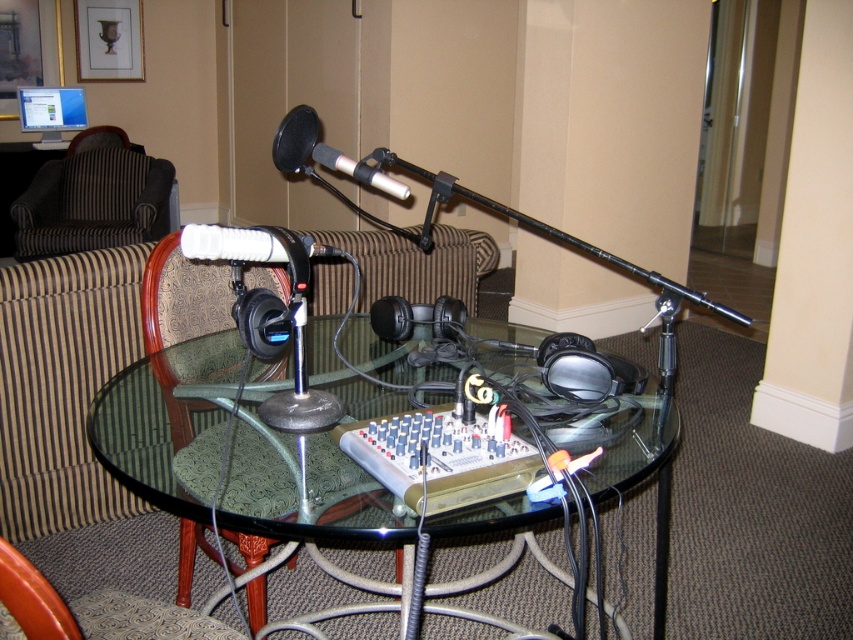
Which is below, striped fabric couch at center or matte black microphone at center?

striped fabric couch at center is lower down.

Who is shorter, striped fabric couch at center or matte black microphone at center?

Standing shorter between the two is matte black microphone at center.

Which is behind, point (109, 260) or point (366, 182)?

The point (109, 260) is more distant.

The height and width of the screenshot is (640, 853). I want to click on striped fabric couch at center, so click(x=62, y=385).

What are the coordinates of `striped fabric couch at center` in the screenshot? It's located at (62, 385).

Is striped fabric couch at center thinner than green fabric armchair at lower left?

No, striped fabric couch at center is not thinner than green fabric armchair at lower left.

Is point (320, 262) farther from camera compared to point (177, 440)?

Yes, point (320, 262) is farther from viewer.

The image size is (853, 640). I want to click on striped fabric couch at center, so click(x=62, y=385).

Is striped fabric couch at center behind striped fabric armchair at left?

No, striped fabric couch at center is in front of striped fabric armchair at left.

Between striped fabric couch at center and striped fabric armchair at left, which one has less height?

Standing shorter between the two is striped fabric armchair at left.

Is point (64, 333) more distant than point (96, 227)?

No, it is not.

Find the location of a particular element. The height and width of the screenshot is (640, 853). striped fabric couch at center is located at coordinates (62, 385).